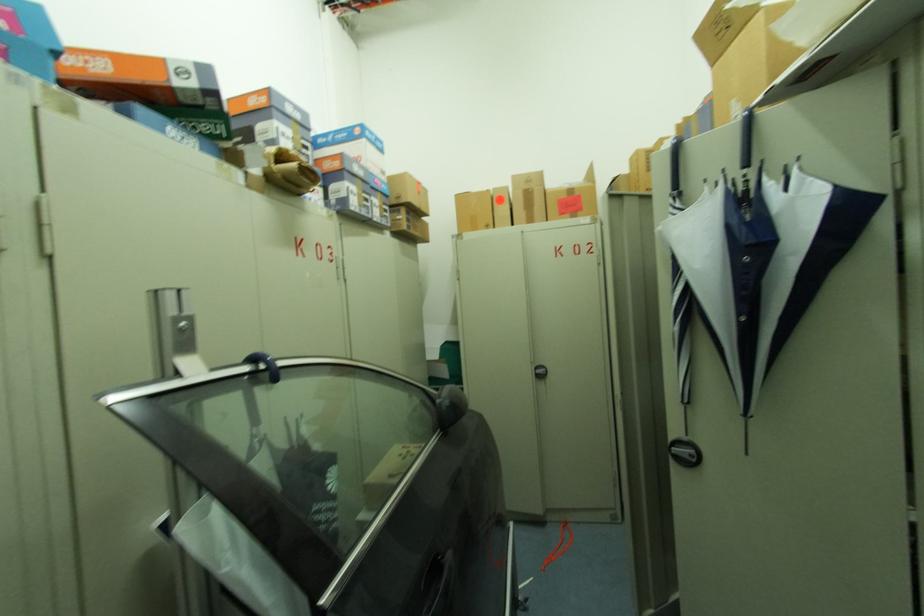
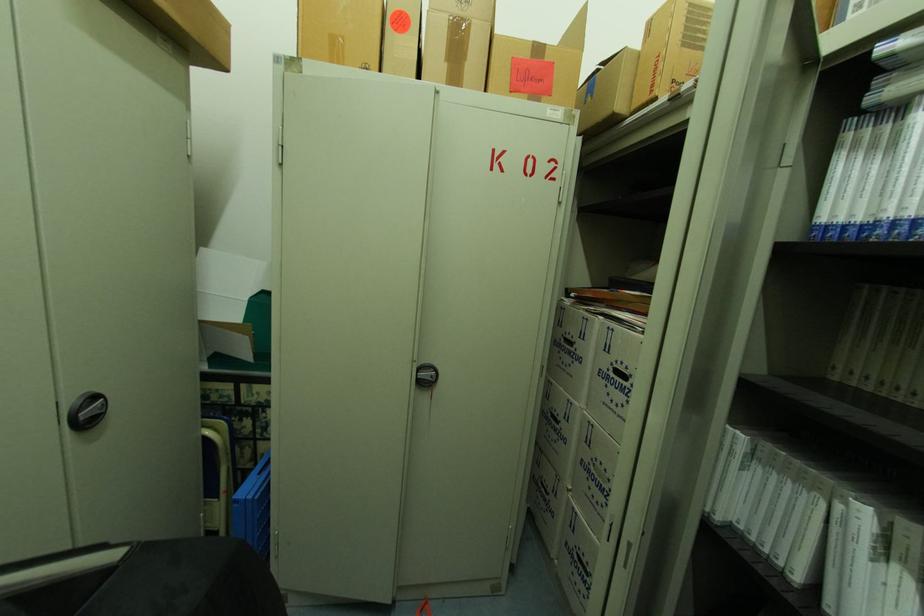
Question: The images are taken continuously from a first-person perspective. In which direction are you moving?

Choices:
 (A) Left
 (B) Right
 (C) Forward
 (D) Backward

Answer: (C)